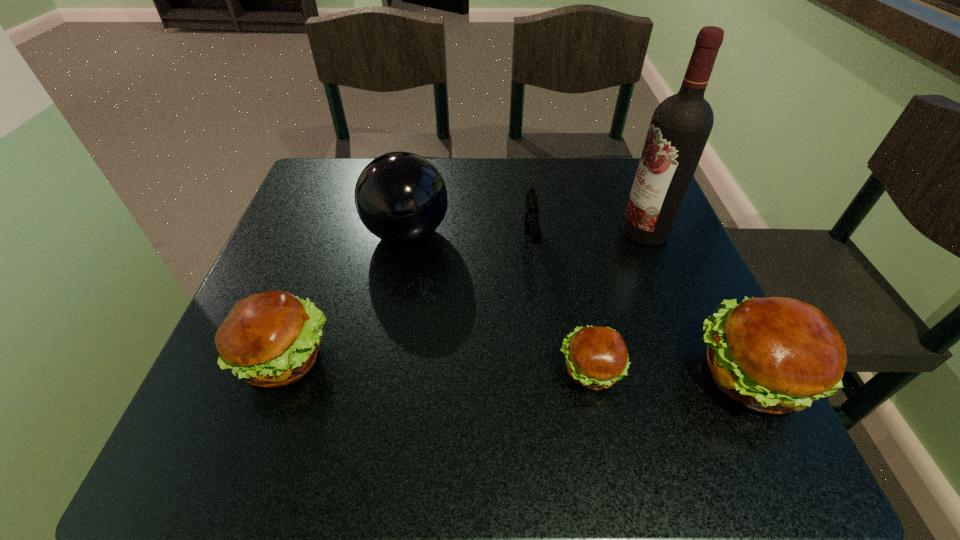
At what (x,y) coordinates should I click in order to perform the action: click on wine bottle at the right edge. Please return your answer as a coordinate pair (x, y). Looking at the image, I should click on (680, 126).

What are the coordinates of `object that is at the near left corner` in the screenshot? It's located at (270, 339).

In order to click on object that is at the near right corner in this screenshot , I will do `click(774, 355)`.

In the image, there is a desktop. Identify the location of free region at the far edge. 586,202.

Locate an element on the screen. The image size is (960, 540). free region at the near edge is located at coordinates (444, 397).

Identify the location of vacant space at the left edge of the desktop. Image resolution: width=960 pixels, height=540 pixels. (324, 213).

Find the location of `vacant region at the right edge of the desktop`. vacant region at the right edge of the desktop is located at coordinates (676, 304).

The height and width of the screenshot is (540, 960). In the image, there is a desktop. Identify the location of vacant space at the far left corner. click(323, 160).

This screenshot has width=960, height=540. Identify the location of vacant space at the far right corner of the desktop. (619, 179).

Where is `vacant space that is in between the shortest object and the pistol`? vacant space that is in between the shortest object and the pistol is located at coordinates pyautogui.click(x=560, y=306).